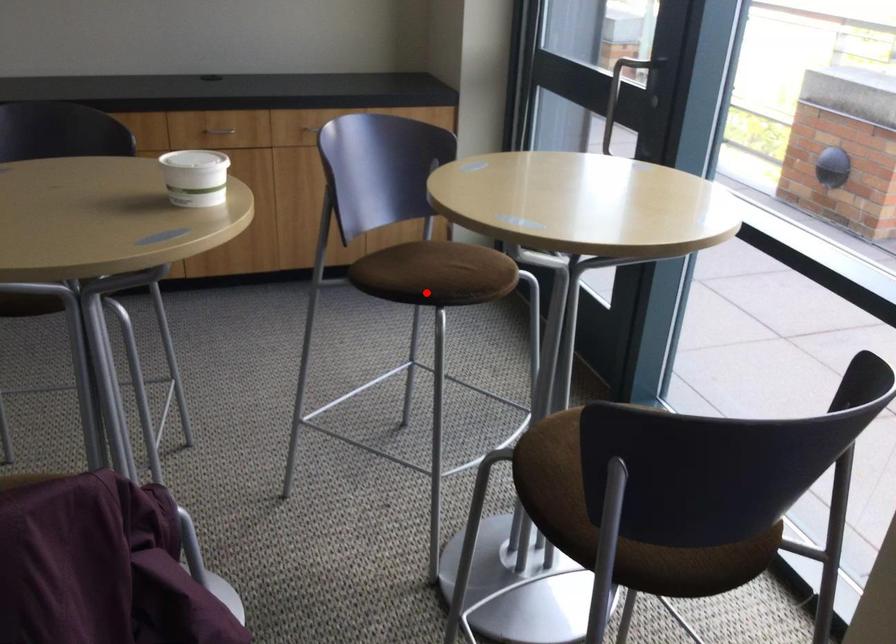
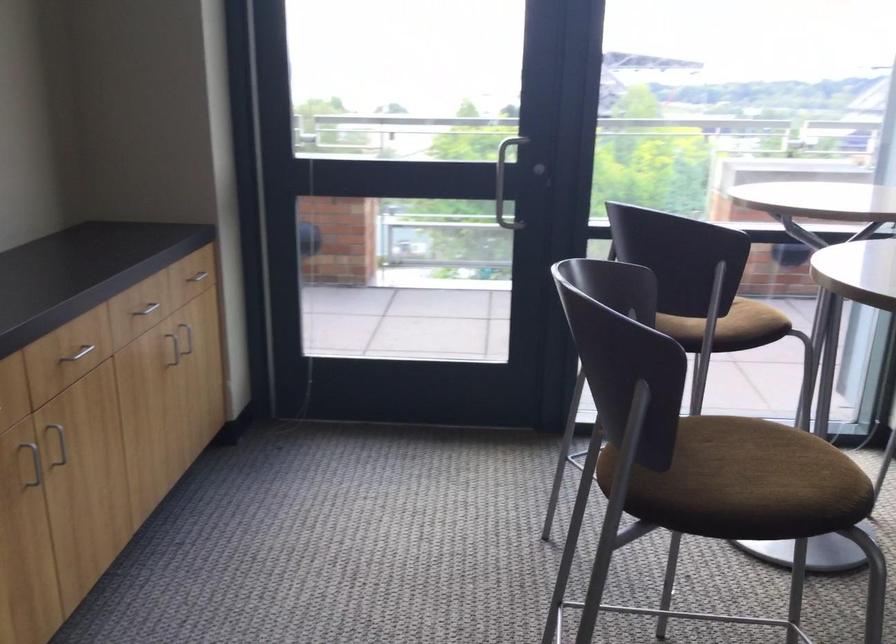
In the second image, find the point that corresponds to the highlighted location in the first image.

(748, 319)